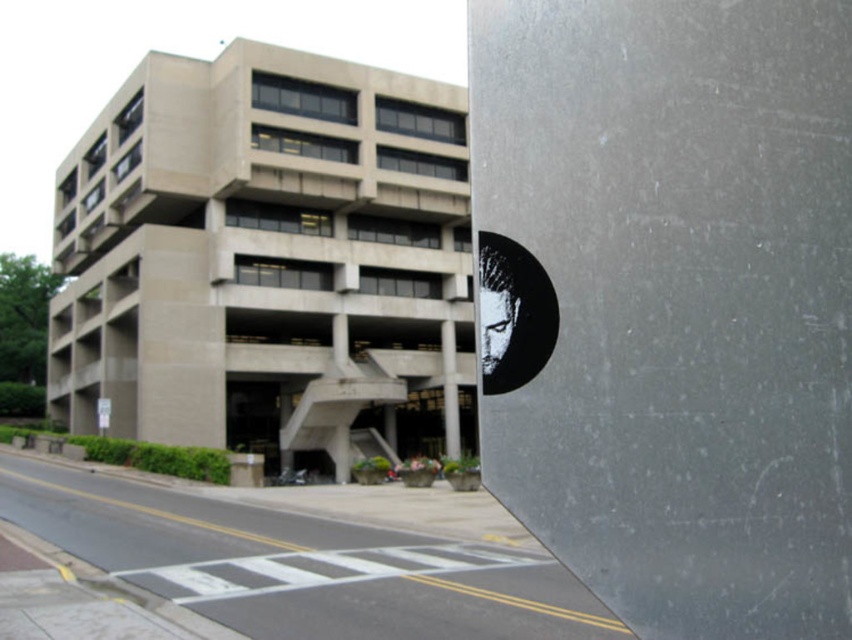
Is black glossy sticker at upper right above white plastic sign at lower left?

Correct, black glossy sticker at upper right is located above white plastic sign at lower left.

In the scene shown: Is black glossy sticker at upper right bigger than white plastic sign at lower left?

Actually, black glossy sticker at upper right might be smaller than white plastic sign at lower left.

Which is behind, point (511, 385) or point (104, 400)?

The point (104, 400) is more distant.

Find the location of a particular element. black glossy sticker at upper right is located at coordinates (511, 314).

Who is higher up, smooth concrete pole at center or white plastic sign at lower left?

white plastic sign at lower left

From the picture: Can you confirm if smooth concrete pole at center is thinner than white plastic sign at lower left?

Yes, smooth concrete pole at center is thinner than white plastic sign at lower left.

Is point (448, 451) positioned in front of point (104, 412)?

No, it is not.

You are a GUI agent. You are given a task and a screenshot of the screen. Output one action in this format:
    pyautogui.click(x=<x>, y=<y>)
    Task: Click on the smooth concrete pole at center
    
    Given the screenshot: What is the action you would take?
    pyautogui.click(x=448, y=388)

Does black glossy sticker at upper right have a smaller size compared to smooth concrete pole at center?

Correct, black glossy sticker at upper right occupies less space than smooth concrete pole at center.

Between point (557, 326) and point (446, 397), which one is positioned behind?

Positioned behind is point (446, 397).

Is point (516, 355) farther from viewer compared to point (446, 413)?

No, (516, 355) is closer to viewer.

Identify the location of black glossy sticker at upper right. The height and width of the screenshot is (640, 852). (511, 314).